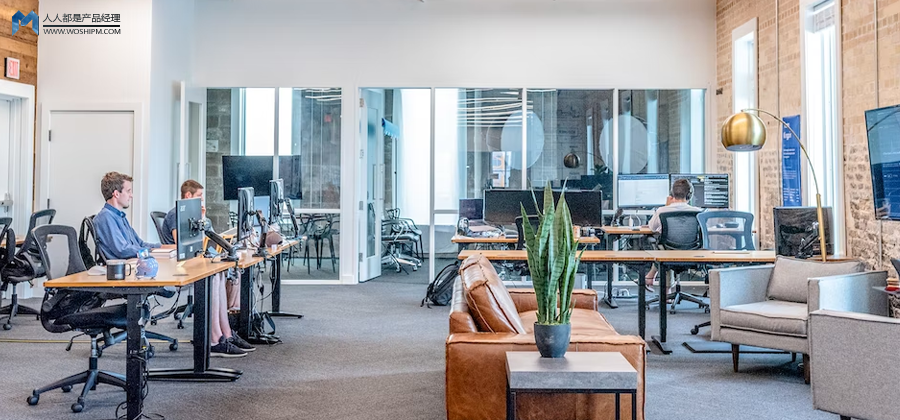
Find the location of a particular element. chair is located at coordinates (82, 319), (24, 257), (5, 265), (157, 228), (684, 231), (732, 231), (519, 233), (412, 229), (400, 237), (322, 233).